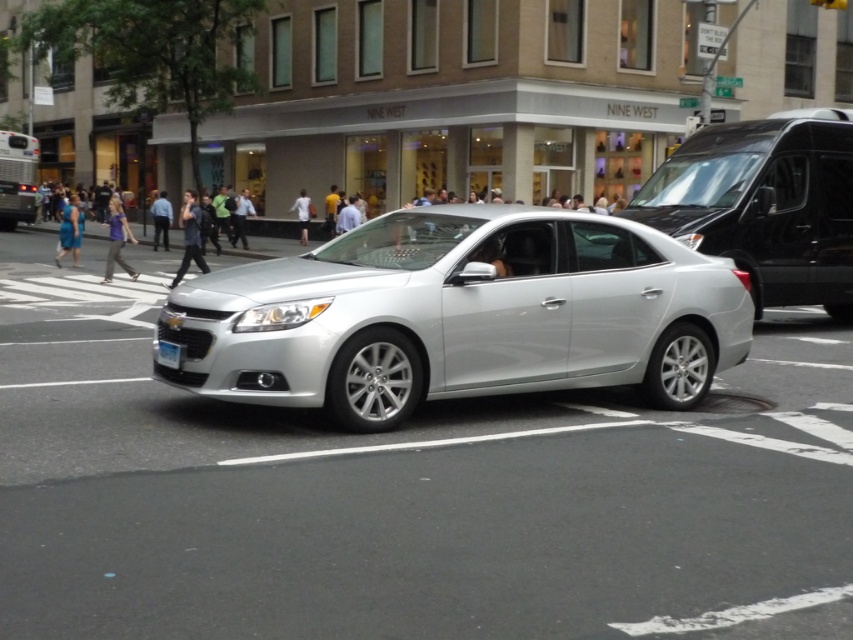
You are a pedestrian standing on the sidewalk and see the shiny black van at center right and the white plastic license plate at center. Which object is closer to you?

The white plastic license plate at center is behind the shiny black van at center right, so the shiny black van at center right is closer to you.

From the picture: You are standing on the sidewalk and see the silver metallic sedan at center approaching you. If the sedan is moving towards you at a constant speed of 5 meters per second, how many seconds will it take for the sedan to reach your position?

The silver metallic sedan at center is 7.18 meters away from you. At a speed of 5 meters per second, it will take approximately 1.44 seconds for the sedan to reach your position.

You are a delivery driver in a shiny black van at center right. You need to take a photo of the Nine West building in the background. Is your van close enough to the camera to capture the entire building in one shot?

The shiny black van at center right and camera are 11.50 meters apart from each other. Since the distance between them is 11.5 meters, the van is close enough to the camera to capture the entire building in one shot.